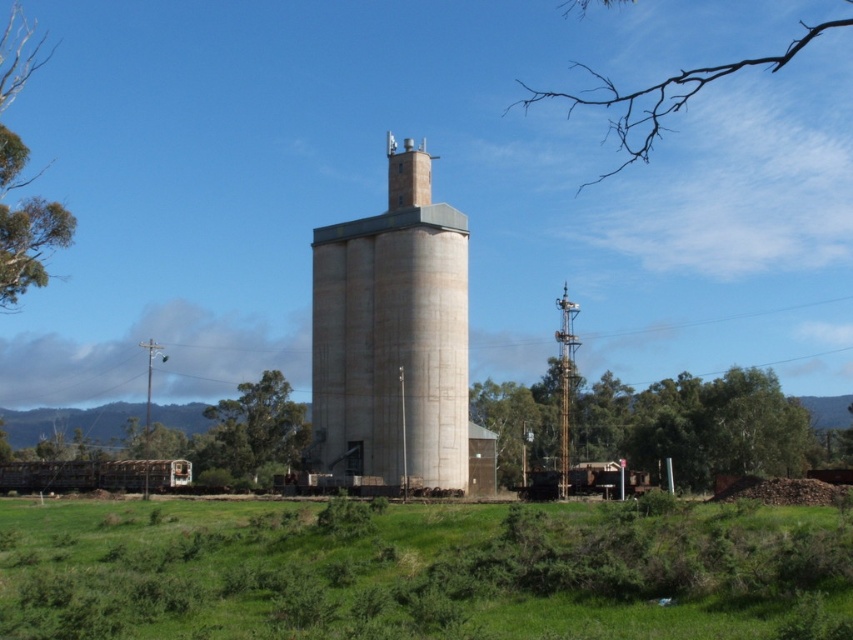
Is point (453, 310) in front of point (635, 122)?

Yes, it is in front of point (635, 122).

Who is shorter, concrete tower at center or brown branch at upper right?

concrete tower at center is shorter.

In order to click on concrete tower at center in this screenshot , I will do `click(392, 337)`.

In the scene shown: Can you confirm if green grass at center is thinner than green leafy tree at upper left?

Correct, green grass at center's width is less than green leafy tree at upper left's.

Between point (309, 636) and point (15, 276), which one is positioned behind?

Positioned behind is point (15, 276).

You are a GUI agent. You are given a task and a screenshot of the screen. Output one action in this format:
    pyautogui.click(x=<x>, y=<y>)
    Task: Click on the green grass at center
    
    Given the screenshot: What is the action you would take?
    pyautogui.click(x=421, y=570)

Does concrete tower at center have a greater width compared to green leafy tree at upper left?

In fact, concrete tower at center might be narrower than green leafy tree at upper left.

Is point (436, 282) less distant than point (10, 20)?

Yes, it is.

Identify the location of concrete tower at center. The image size is (853, 640). (392, 337).